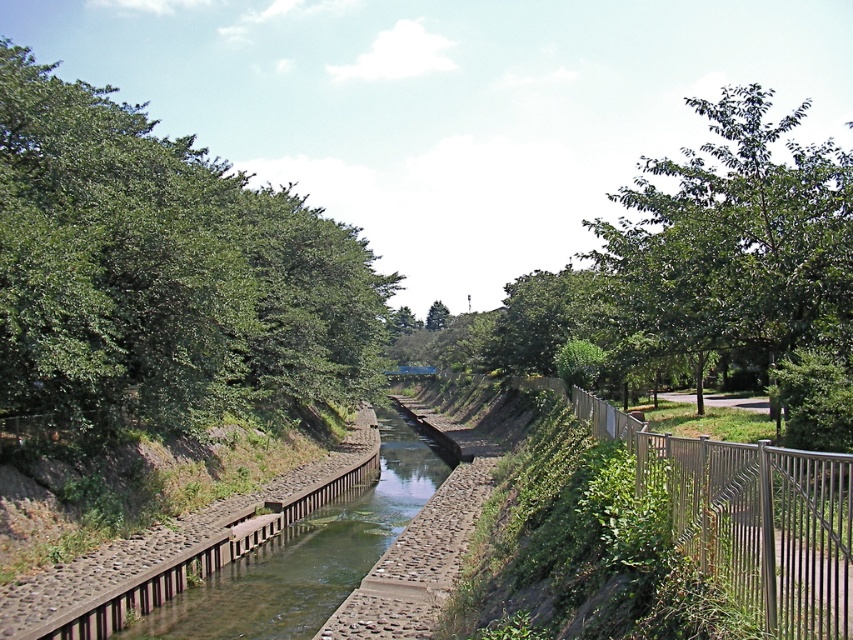
You are standing at the entrance of the canal and want to take a photo of both the green leafy tree at upper right and the green leafy tree at center. Which tree should you position yourself closer to in order to capture both in the same frame?

You should position yourself closer to the green leafy tree at upper right because it is in front of the green leafy tree at center, so moving closer to it will help include both trees in the frame without one being obscured.

You are a photographer planning to capture the canal scene. You want to ensure that the green leafy tree at upper right and the metallic silver fence at right are both visible in your shot. Based on their widths, which object will occupy more space horizontally in the photograph?

The green leafy tree at upper right will occupy more space horizontally in the photograph since its width surpasses that of the metallic silver fence at right.

You are standing on the left bank of the canal and want to take a photo of the green leafy tree at upper right and the metallic silver fence at right. Which object should you focus on first to ensure both are in the frame?

You should focus on the green leafy tree at upper right first because it is closer to you than the metallic silver fence at right, so it will be in focus first.